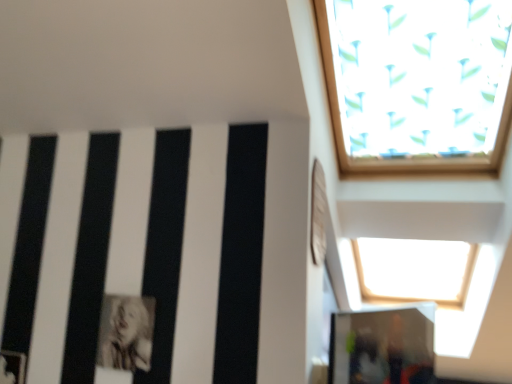
Question: Relative to transparent glass door at lower right, is black and white photograph of a person at lower left in front or behind?

Choices:
 (A) front
 (B) behind

Answer: (B)

Question: Is black and white photograph of a person at lower left situated inside transparent glass door at lower right or outside?

Choices:
 (A) inside
 (B) outside

Answer: (B)

Question: Would you say black and white photograph of a person at lower left is to the left or to the right of transparent glass door at lower right in the picture?

Choices:
 (A) right
 (B) left

Answer: (B)

Question: From the image's perspective, is transparent glass door at lower right positioned above or below black and white photograph of a person at lower left?

Choices:
 (A) above
 (B) below

Answer: (B)

Question: Does point (346, 342) appear closer or farther from the camera than point (148, 327)?

Choices:
 (A) closer
 (B) farther

Answer: (A)

Question: Is transparent glass door at lower right wider or thinner than black and white photograph of a person at lower left?

Choices:
 (A) thin
 (B) wide

Answer: (B)

Question: In the image, is transparent glass door at lower right on the left side or the right side of black and white photograph of a person at lower left?

Choices:
 (A) left
 (B) right

Answer: (B)